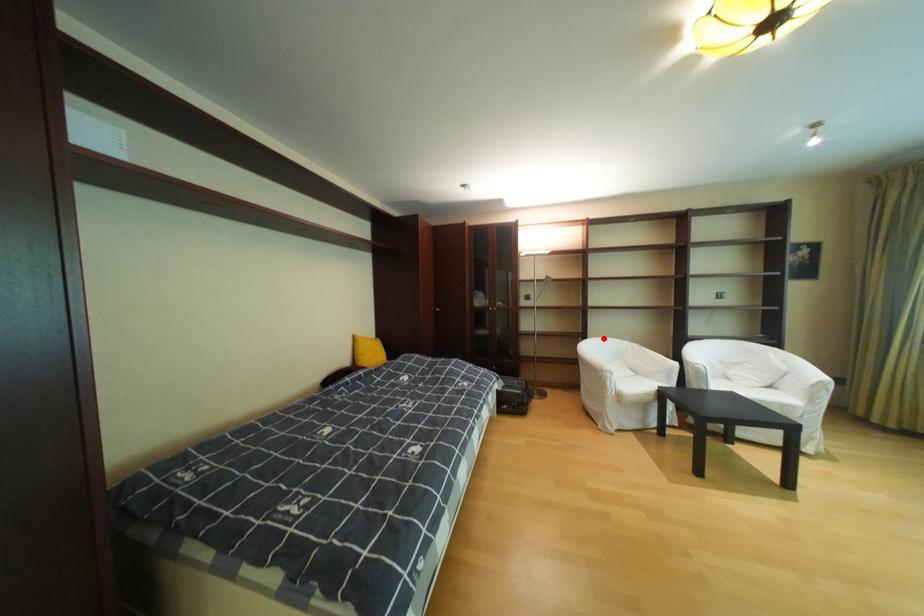
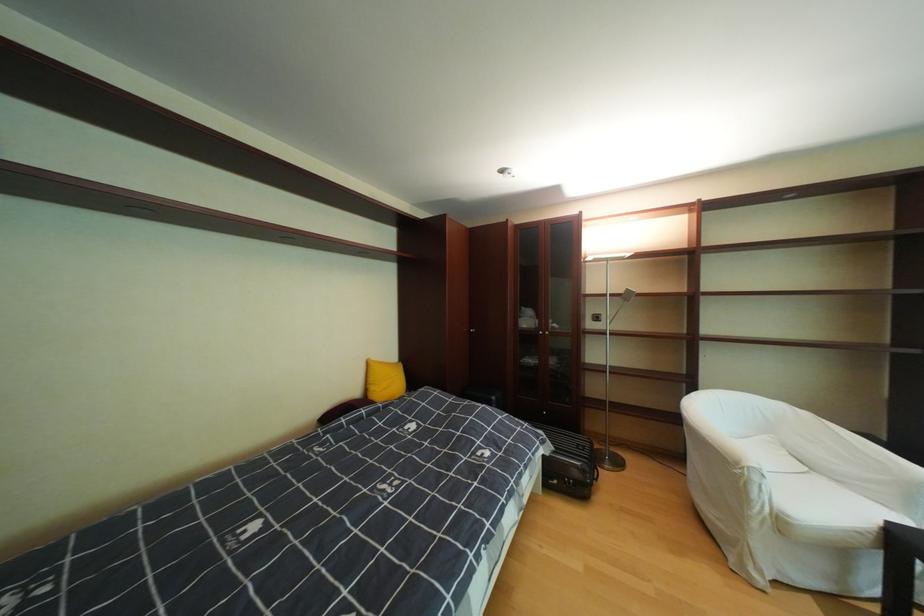
In the second image, find the point that corresponds to the highlighted location in the first image.

(719, 389)